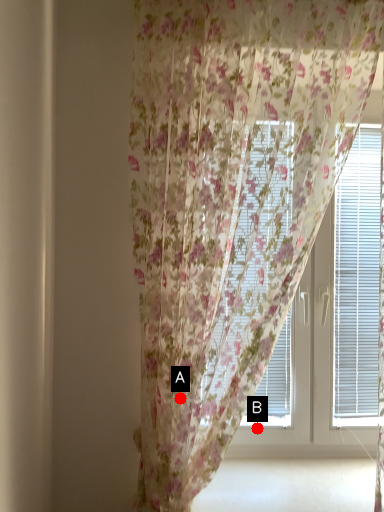
Question: Two points are circled on the image, labeled by A and B beside each circle. Which point is closer to the camera?

Choices:
 (A) A is closer
 (B) B is closer

Answer: (A)